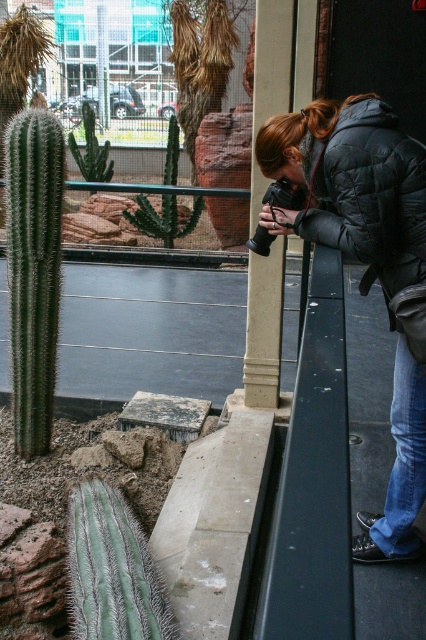
Can you confirm if black quilted jacket at upper right is bigger than green spiny cactus at center?

Yes, black quilted jacket at upper right is bigger than green spiny cactus at center.

Does black quilted jacket at upper right have a lesser height compared to green spiny cactus at center?

No, black quilted jacket at upper right is not shorter than green spiny cactus at center.

Does point (270, 122) come in front of point (167, 202)?

Yes, point (270, 122) is closer to viewer.

Identify the location of black quilted jacket at upper right. (365, 260).

Does green spiny cactus at center lie in front of green spiky cactus at center?

Yes.

Does point (149, 224) come in front of point (89, 122)?

Yes, it is.

What do you see at coordinates (163, 218) in the screenshot?
I see `green spiny cactus at center` at bounding box center [163, 218].

Locate an element on the screen. Image resolution: width=426 pixels, height=640 pixels. green spiny cactus at center is located at coordinates (163, 218).

Is point (368, 150) more distant than point (28, 225)?

No, (368, 150) is in front of (28, 225).

What do you see at coordinates (365, 260) in the screenshot? The image size is (426, 640). I see `black quilted jacket at upper right` at bounding box center [365, 260].

Find the location of a particular element. black quilted jacket at upper right is located at coordinates (365, 260).

Find the location of a particular element. This screenshot has width=426, height=640. black quilted jacket at upper right is located at coordinates (365, 260).